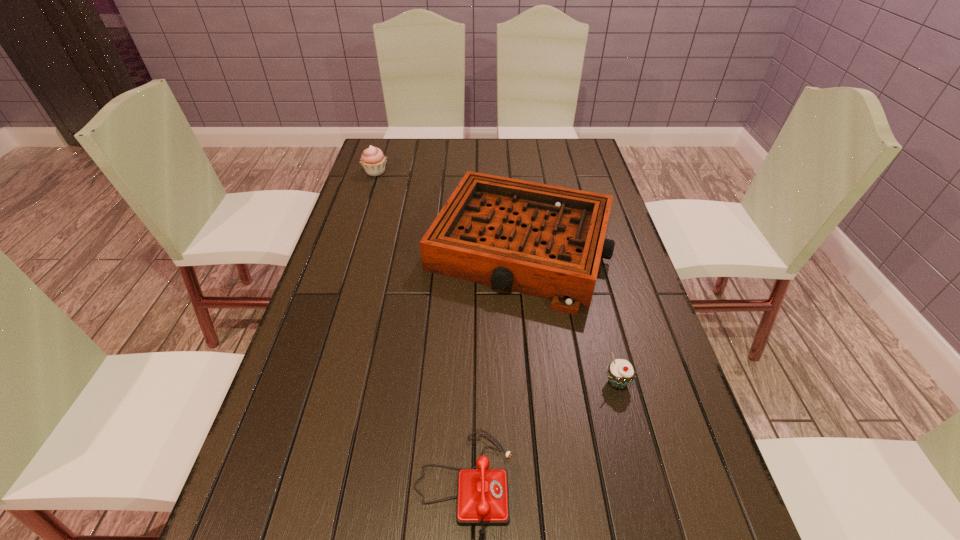
Locate an element on the screen. gameboard that is at the right edge is located at coordinates (546, 241).

You are a GUI agent. You are given a task and a screenshot of the screen. Output one action in this format:
    pyautogui.click(x=<x>, y=<y>)
    Task: Click on the cupcake located in the right edge section of the desktop
    This screenshot has width=960, height=540.
    Given the screenshot: What is the action you would take?
    pyautogui.click(x=620, y=372)

At what (x,y) coordinates should I click in order to perform the action: click on object at the far left corner. Please return your answer as a coordinate pair (x, y). This screenshot has height=540, width=960. Looking at the image, I should click on (373, 160).

This screenshot has width=960, height=540. In the image, there is a desktop. Identify the location of free space at the far edge. (549, 161).

In the image, there is a desktop. Find the location of `blank space at the left edge`. blank space at the left edge is located at coordinates (376, 289).

Find the location of a particular element. The height and width of the screenshot is (540, 960). vacant space at the right edge of the desktop is located at coordinates (627, 277).

Where is `blank area at the far right corner`? blank area at the far right corner is located at coordinates (579, 151).

At what (x,y) coordinates should I click in order to perform the action: click on free point between the shorter cupcake and the second farthest object. Please return your answer as a coordinate pair (x, y). The width and height of the screenshot is (960, 540). Looking at the image, I should click on (569, 315).

In order to click on vacant region between the third nearest object and the shorter cupcake in this screenshot , I will do `click(569, 315)`.

The width and height of the screenshot is (960, 540). Find the location of `vacant area between the nearer cupcake and the gameboard`. vacant area between the nearer cupcake and the gameboard is located at coordinates (569, 315).